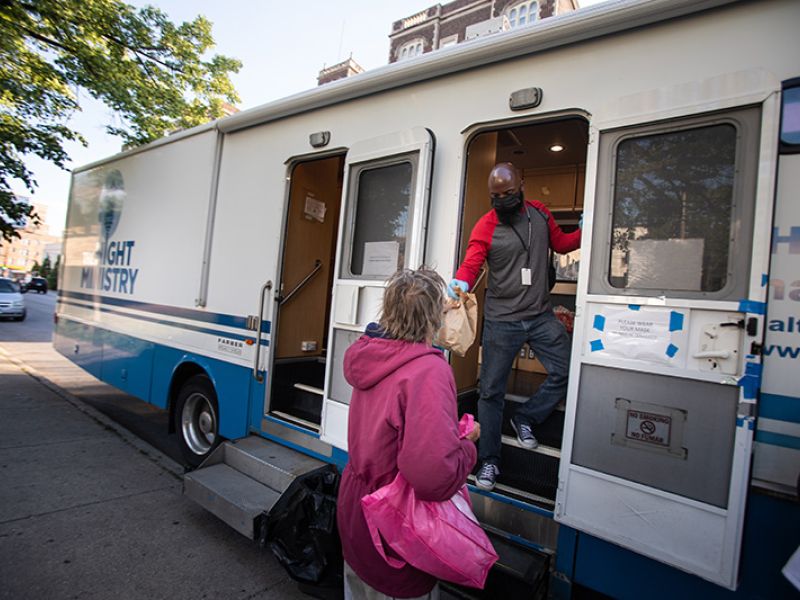
Identify the location of door. Image resolution: width=800 pixels, height=600 pixels. (688, 447), (354, 273).